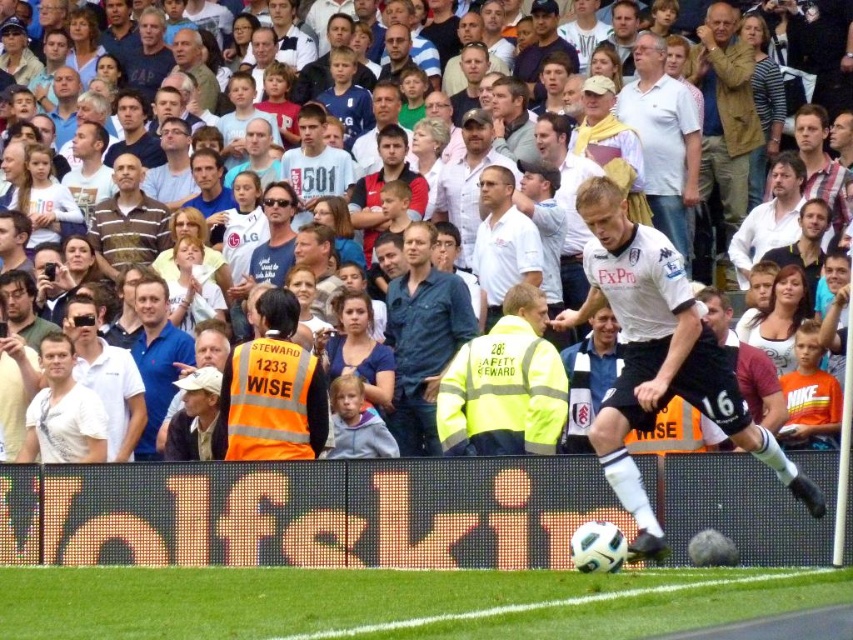
You are a photographer at the soccer match. You want to take a photo that includes both the white jersey at center and the white cotton shirt at upper center. Which one should you zoom in on more to ensure both are visible in the frame?

→ The white jersey at center is taller than the white cotton shirt at upper center, so you should zoom in more on the white cotton shirt at upper center to ensure both are visible in the frame.

You are a photographer trying to capture a clear shot of the white jersey at center and the white cotton shirt at upper center. Since you want to focus on the larger object, which one should you zoom in on?

The white jersey at center is larger in width than the white cotton shirt at upper center, so you should zoom in on the white jersey at center.